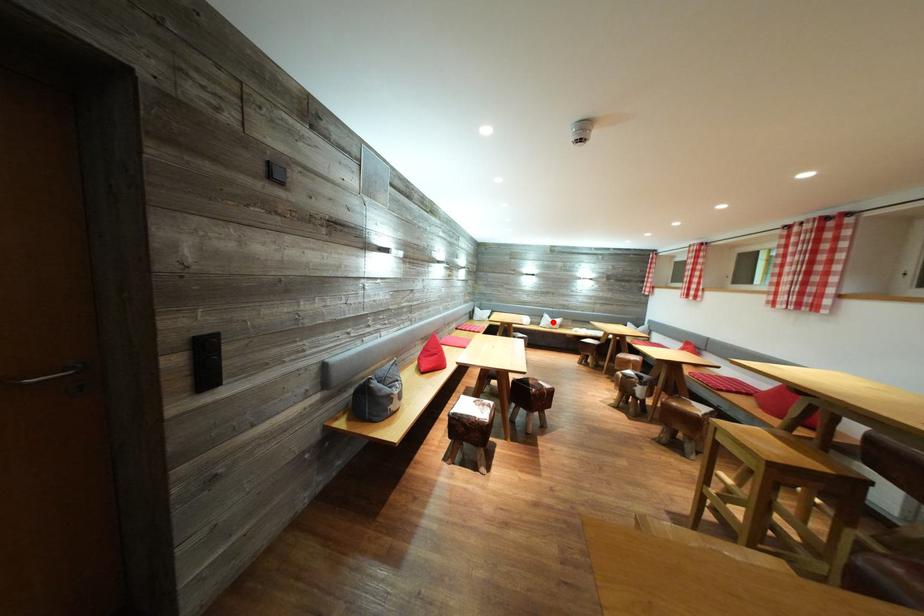
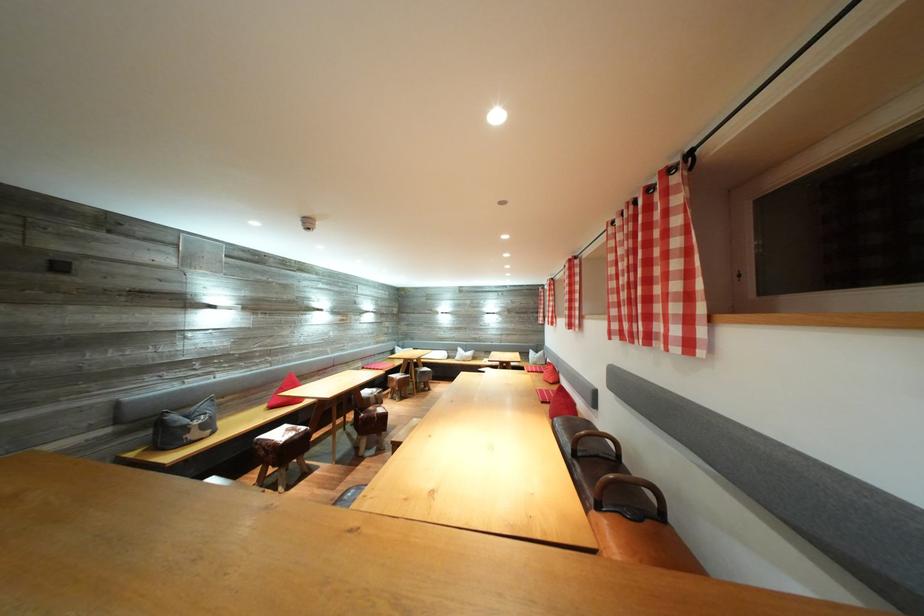
The point at the highlighted location is marked in the first image. Where is the corresponding point in the second image?

(467, 355)